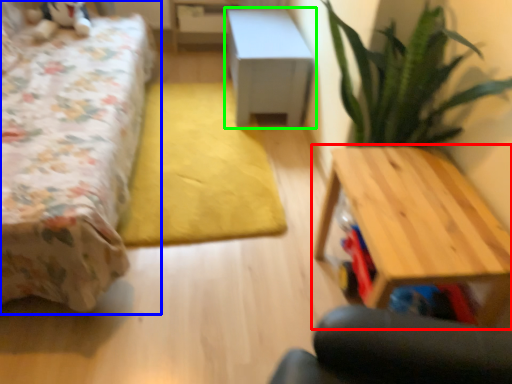
Question: Which object is the closest to the table (highlighted by a red box)? Choose among these: bed (highlighted by a blue box) or table (highlighted by a green box).

Choices:
 (A) bed
 (B) table

Answer: (A)